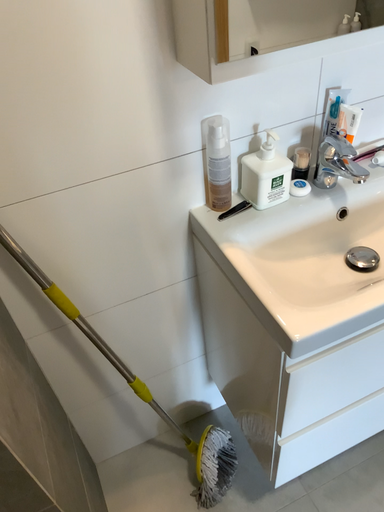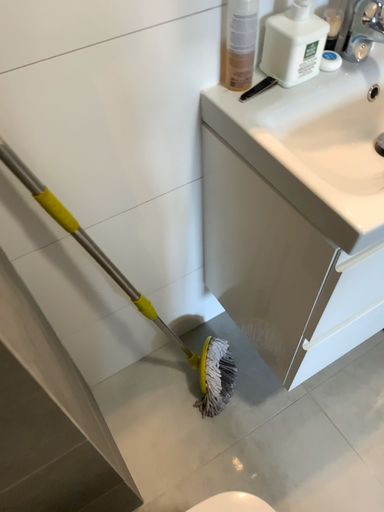
Question: How did the camera likely rotate when shooting the video?

Choices:
 (A) rotated downward
 (B) rotated upward

Answer: (A)